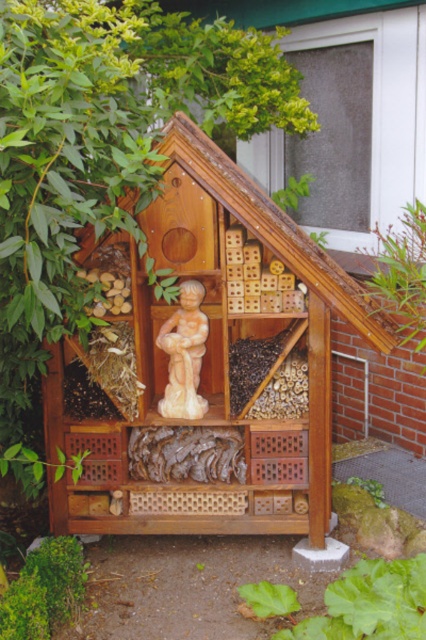
Which is behind, point (37, 566) or point (180, 412)?

Positioned behind is point (180, 412).

Who is shorter, green leafy bush at lower left or beige stone statue at center?

green leafy bush at lower left

Locate an element on the screen. green leafy bush at lower left is located at coordinates (43, 589).

Does point (368, 573) come in front of point (187, 385)?

That is True.

Does green leafy plant at lower center have a greater width compared to beige stone statue at center?

Yes, green leafy plant at lower center is wider than beige stone statue at center.

The image size is (426, 640). Describe the element at coordinates (371, 604) in the screenshot. I see `green leafy plant at lower center` at that location.

Locate an element on the screen. green leafy plant at lower center is located at coordinates (371, 604).

From the picture: Measure the distance between green leafy plant at lower center and camera.

green leafy plant at lower center is 1.92 meters from camera.

Between green leafy plant at lower center and green leafy bush at lower left, which one has more height?

green leafy plant at lower center

Image resolution: width=426 pixels, height=640 pixels. What do you see at coordinates (371, 604) in the screenshot?
I see `green leafy plant at lower center` at bounding box center [371, 604].

Identify the location of green leafy plant at lower center. (371, 604).